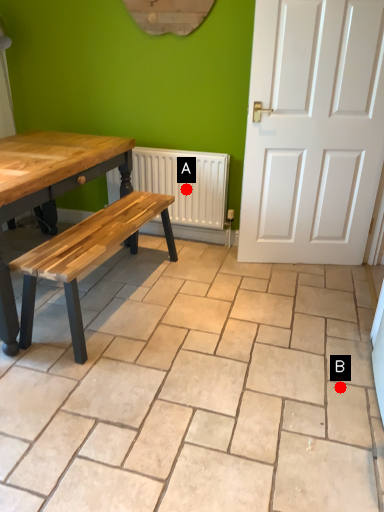
Question: Two points are circled on the image, labeled by A and B beside each circle. Which point appears closest to the camera in this image?

Choices:
 (A) A is closer
 (B) B is closer

Answer: (B)